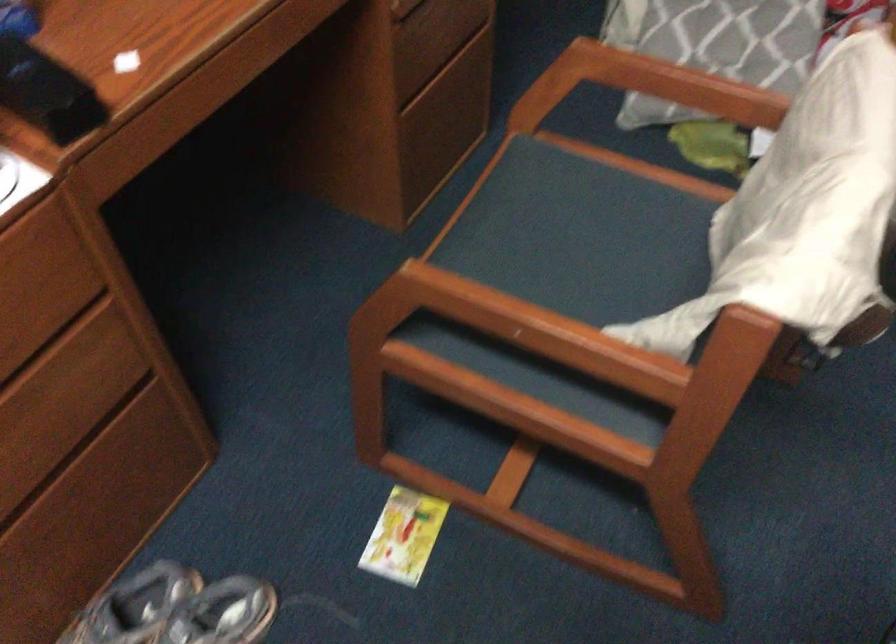
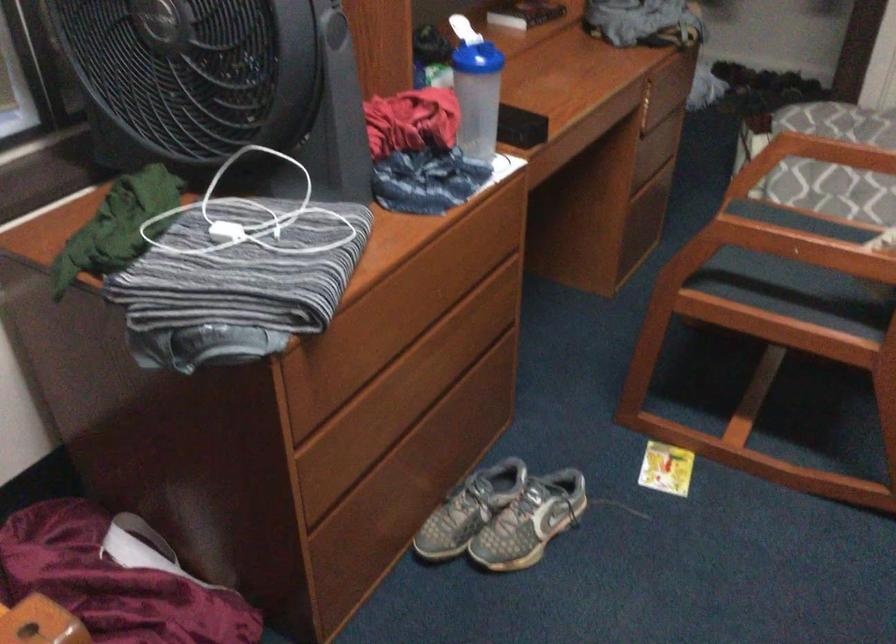
The point at (418, 77) is marked in the first image. Where is the corresponding point in the second image?

(643, 169)